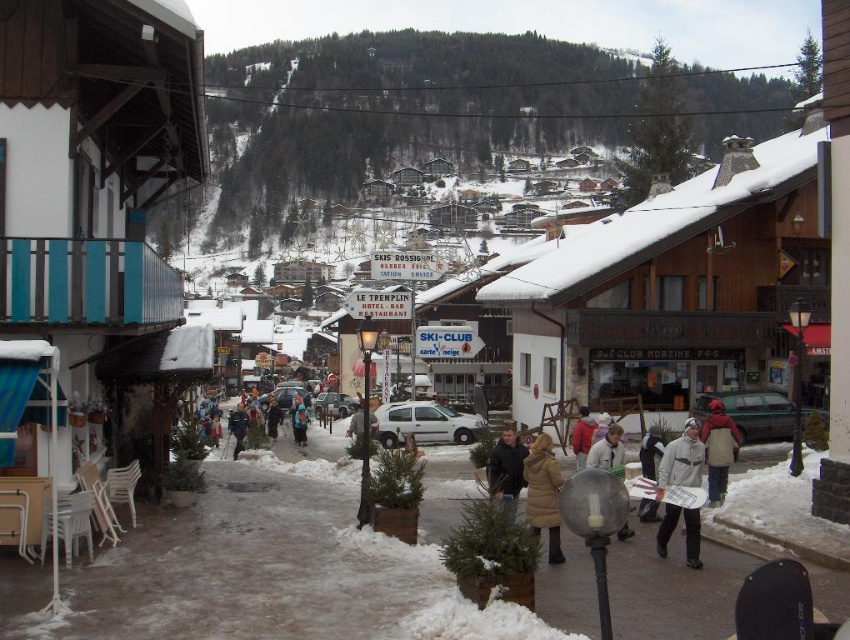
You are standing at the starting point in the village and want to reach a destination. You have two points marked on your map as point 1 at coordinates point (x=700, y=433) and point 2 at coordinates point (x=613, y=451). Which point is closer to your current position?

Point (x=613, y=451) is closer to your current position because it is closer to the camera than point (x=700, y=433).

You are a photographer planning to take a group photo of two friends wearing the gray woolen jacket at center and the blue woolen jacket at center. If you want both jackets to appear the same size in the photo, what should you do?

To make both jackets appear the same size in the photo, move the gray woolen jacket at center further away from the camera and bring the blue woolen jacket at center closer, since the gray woolen jacket at center is physically larger than the blue woolen jacket at center.